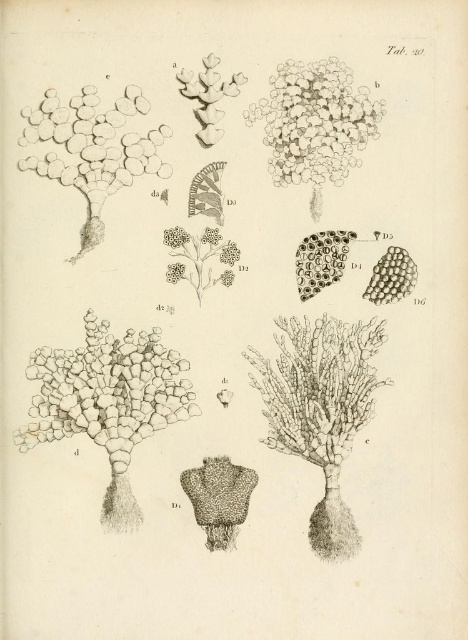
Question: Estimate the real-world distances between objects in this image. Which object is closer to the white matte flower at upper center?

Choices:
 (A) white textured cluster at upper center
 (B) gray textured plant at center

Answer: (A)

Question: Does gray textured coral at lower left have a larger size compared to white matte flower at upper center?

Choices:
 (A) no
 (B) yes

Answer: (B)

Question: Is gray textured coral at lower left bigger than smooth white pebbles at upper left?

Choices:
 (A) no
 (B) yes

Answer: (B)

Question: From the image, what is the correct spatial relationship of white textured cluster at upper center in relation to white matte flower at upper center?

Choices:
 (A) right
 (B) left

Answer: (A)

Question: Which point is farther to the camera?

Choices:
 (A) (305, 168)
 (B) (307, 410)

Answer: (A)

Question: Which point is closer to the camera?

Choices:
 (A) gray textured coral at lower left
 (B) gray textured plant at center
 (C) white textured cluster at upper center
 (D) smooth white pebbles at upper left

Answer: (B)